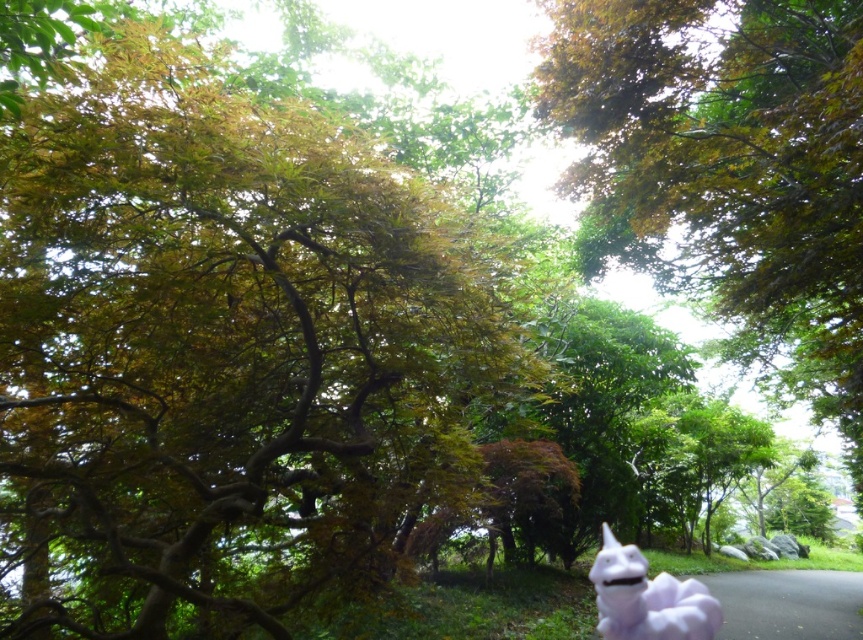
You are a photographer trying to capture the white plush toy at lower right in your shot. However, you notice that the green leafy tree at upper center is blocking your view. Can you move to a position where you can see both objects clearly?

The white plush toy at lower right is behind the green leafy tree at upper center, so moving to a position where you can see both clearly might not be possible without moving one of the objects. The tree is blocking the view of the toy.

You are a small dog with a 1 meter long leash. You are tied to the green leafy tree at upper left and want to reach the white plush toy at lower right. Can you reach it?

The distance between the green leafy tree at upper left and the white plush toy at lower right is 1.36 meters, which is longer than the 1 meter leash. Therefore, the dog cannot reach the white plush toy at lower right.

You are a photographer setting up a tripod in the park. You want to frame both the green leafy tree at upper center and the white plush toy at lower right in your shot. Based on their sizes, which object should you focus on first to ensure they both fit in the frame?

The green leafy tree at upper center might be wider than the white plush toy at lower right, so you should focus on framing the green leafy tree at upper center first to ensure both fit in the frame.